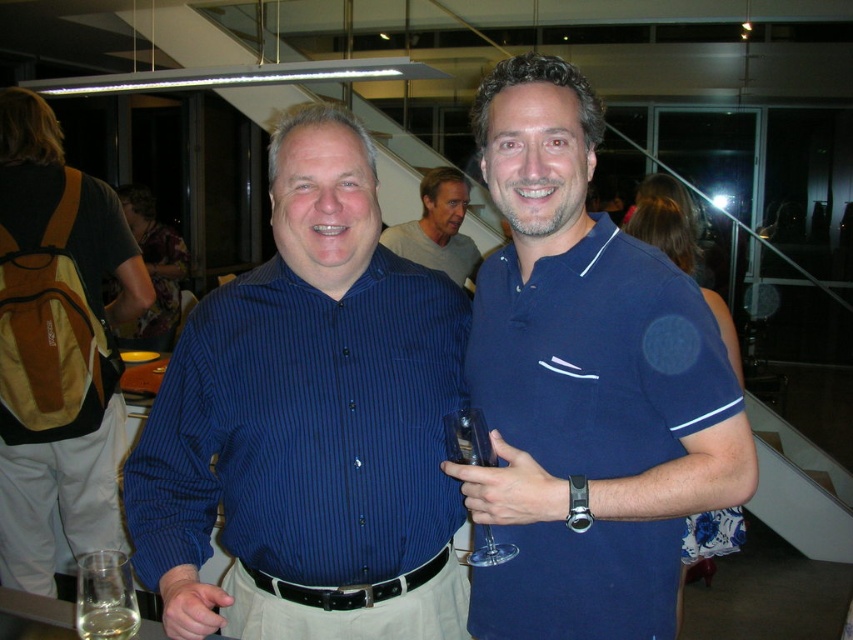
Is point (397, 289) less distant than point (103, 620)?

No, (397, 289) is further to viewer.

Who is higher up, blue striped shirt at center or translucent glass at lower left?

blue striped shirt at center is above.

The image size is (853, 640). What are the coordinates of `blue striped shirt at center` in the screenshot? It's located at (309, 422).

What do you see at coordinates (309, 422) in the screenshot? The height and width of the screenshot is (640, 853). I see `blue striped shirt at center` at bounding box center [309, 422].

In the scene shown: Can you confirm if blue striped shirt at center is positioned below matte blue shirt at center?

Indeed, blue striped shirt at center is positioned under matte blue shirt at center.

The image size is (853, 640). What do you see at coordinates (309, 422) in the screenshot? I see `blue striped shirt at center` at bounding box center [309, 422].

Identify the location of blue striped shirt at center. This screenshot has width=853, height=640. (309, 422).

Is matte blue shirt at center further to the viewer compared to transparent plastic wine glass at center?

That is True.

Between matte blue shirt at center and transparent plastic wine glass at center, which one is positioned lower?

transparent plastic wine glass at center is below.

This screenshot has width=853, height=640. I want to click on matte blue shirt at center, so click(x=437, y=227).

The width and height of the screenshot is (853, 640). Identify the location of matte blue shirt at center. (437, 227).